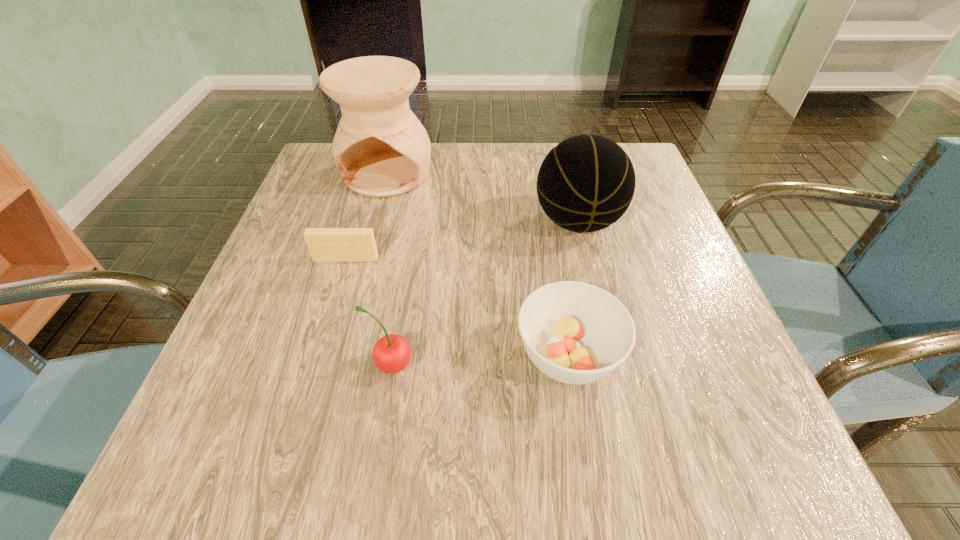
The image size is (960, 540). Identify the location of vacant space at the left edge of the desktop. (290, 213).

I want to click on free space at the right edge of the desktop, so click(x=637, y=249).

At what (x,y) coordinates should I click in order to perform the action: click on vacant space at the near right corner. Please return your answer as a coordinate pair (x, y). Looking at the image, I should click on (710, 470).

I want to click on free area in between the second shortest object and the videotape, so click(x=457, y=307).

This screenshot has height=540, width=960. I want to click on empty location between the fourth tallest object and the tallest object, so click(478, 264).

Where is `free area in between the tallest object and the basketball`? This screenshot has height=540, width=960. free area in between the tallest object and the basketball is located at coordinates (482, 198).

The height and width of the screenshot is (540, 960). Find the location of `free space between the videotape and the tallest object`. free space between the videotape and the tallest object is located at coordinates (367, 216).

Find the location of a particular element. Image resolution: width=960 pixels, height=540 pixels. free space between the tallest object and the fourth tallest object is located at coordinates (478, 264).

Identify which object is the third nearest to the second tallest object. Please provide its 2D coordinates. Your answer should be formatted as a tuple, i.e. [(x, y)], where the tuple contains the x and y coordinates of a point satisfying the conditions above.

[(325, 244)]

Locate which object ranks third in proximity to the videotape. Please provide its 2D coordinates. Your answer should be formatted as a tuple, i.e. [(x, y)], where the tuple contains the x and y coordinates of a point satisfying the conditions above.

[(576, 333)]